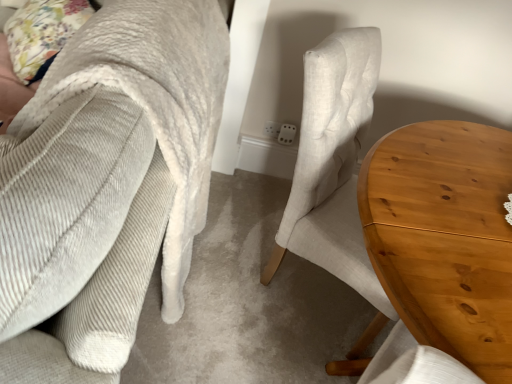
Image resolution: width=512 pixels, height=384 pixels. Describe the element at coordinates (106, 186) in the screenshot. I see `corduroy fabric chair at center` at that location.

Image resolution: width=512 pixels, height=384 pixels. I want to click on light brown wood table at center right, so click(445, 237).

This screenshot has width=512, height=384. I want to click on floral fabric pillow at upper left, so click(x=42, y=34).

From a real-world perspective, is corduroy fabric chair at center on floral fabric pillow at upper left?

No.

Considering the relative sizes of corduroy fabric chair at center and floral fabric pillow at upper left in the image provided, is corduroy fabric chair at center bigger than floral fabric pillow at upper left?

Yes, corduroy fabric chair at center is bigger than floral fabric pillow at upper left.

Which is closer, (15,175) or (29,11)?

Point (15,175)

From the image's perspective, does corduroy fabric chair at center appear lower than floral fabric pillow at upper left?

Yes, from the image's perspective, corduroy fabric chair at center is beneath floral fabric pillow at upper left.

Is floral fabric pillow at upper left to the left or to the right of light brown wood table at center right in the image?

Based on their positions, floral fabric pillow at upper left is located to the left of light brown wood table at center right.

You are a GUI agent. You are given a task and a screenshot of the screen. Output one action in this format:
    pyautogui.click(x=<x>, y=<y>)
    Task: Click on the pillow above the light brown wood table at center right (from the image's perspective)
    The width and height of the screenshot is (512, 384).
    Given the screenshot: What is the action you would take?
    pyautogui.click(x=42, y=34)

Considering the sizes of objects floral fabric pillow at upper left and light brown wood table at center right in the image provided, who is bigger, floral fabric pillow at upper left or light brown wood table at center right?

light brown wood table at center right.

Is floral fabric pillow at upper left inside or outside of light brown wood table at center right?

floral fabric pillow at upper left is not inside light brown wood table at center right, it's outside.

Which object is closer to the camera, light brown wood table at center right or floral fabric pillow at upper left?

Positioned in front is light brown wood table at center right.

Is light brown wood table at center right in contact with floral fabric pillow at upper left?

There is a gap between light brown wood table at center right and floral fabric pillow at upper left.

From the picture: Can you confirm if light brown wood table at center right is wider than floral fabric pillow at upper left?

Yes, light brown wood table at center right is wider than floral fabric pillow at upper left.

Is light brown wood table at center right to the right of floral fabric pillow at upper left from the viewer's perspective?

Correct, you'll find light brown wood table at center right to the right of floral fabric pillow at upper left.

Based on their sizes in the image, would you say light brown wood table at center right is bigger or smaller than corduroy fabric chair at center?

Clearly, light brown wood table at center right is smaller in size than corduroy fabric chair at center.

Which is more to the right, light brown wood table at center right or corduroy fabric chair at center?

From the viewer's perspective, light brown wood table at center right appears more on the right side.

From the image's perspective, is light brown wood table at center right under corduroy fabric chair at center?

Yes, from the image's perspective, light brown wood table at center right is beneath corduroy fabric chair at center.

In the scene shown: Measure the distance from corduroy fabric chair at center to light brown wood table at center right.

corduroy fabric chair at center and light brown wood table at center right are 24.75 inches apart from each other.

At what (x,y) coordinates should I click in order to perform the action: click on table that appears on the right of corduroy fabric chair at center. Please return your answer as a coordinate pair (x, y). Image resolution: width=512 pixels, height=384 pixels. Looking at the image, I should click on (445, 237).

From a real-world perspective, which is physically below, corduroy fabric chair at center or light brown wood table at center right?

From a 3D spatial view, light brown wood table at center right is below.

Based on the photo, is corduroy fabric chair at center aimed at light brown wood table at center right?

No, corduroy fabric chair at center is not oriented towards light brown wood table at center right.

From the image's perspective, who appears lower, floral fabric pillow at upper left or corduroy fabric chair at center?

corduroy fabric chair at center, from the image's perspective.

Is point (61, 21) positioned in front of point (120, 111)?

No.

Is floral fabric pillow at upper left positioned with its back to corduroy fabric chair at center?

Yes, corduroy fabric chair at center is at the back of floral fabric pillow at upper left.

Is floral fabric pillow at upper left far away from corduroy fabric chair at center?

That's not correct — floral fabric pillow at upper left is a little close to corduroy fabric chair at center.

Locate an element on the screen. This screenshot has height=384, width=512. chair that appears below the floral fabric pillow at upper left (from the image's perspective) is located at coordinates (106, 186).

Locate an element on the screen. This screenshot has width=512, height=384. table lying on the right of floral fabric pillow at upper left is located at coordinates (445, 237).

Based on their spatial positions, is light brown wood table at center right or floral fabric pillow at upper left further from corduroy fabric chair at center?

floral fabric pillow at upper left.

From the image, which object appears to be farther from light brown wood table at center right, corduroy fabric chair at center or floral fabric pillow at upper left?

Based on the image, floral fabric pillow at upper left appears to be further to light brown wood table at center right.

Based on their spatial positions, is corduroy fabric chair at center or light brown wood table at center right closer to floral fabric pillow at upper left?

The object closer to floral fabric pillow at upper left is corduroy fabric chair at center.

Considering their positions, is light brown wood table at center right positioned further to floral fabric pillow at upper left than corduroy fabric chair at center?

Based on the image, light brown wood table at center right appears to be further to floral fabric pillow at upper left.

When comparing their distances from light brown wood table at center right, does floral fabric pillow at upper left or corduroy fabric chair at center seem closer?

Based on the image, corduroy fabric chair at center appears to be nearer to light brown wood table at center right.

Looking at the image, which one is located closer to corduroy fabric chair at center, floral fabric pillow at upper left or light brown wood table at center right?

light brown wood table at center right lies closer to corduroy fabric chair at center than the other object.

The width and height of the screenshot is (512, 384). What are the coordinates of `pillow located between corduroy fabric chair at center and light brown wood table at center right in the left-right direction` in the screenshot? It's located at (42, 34).